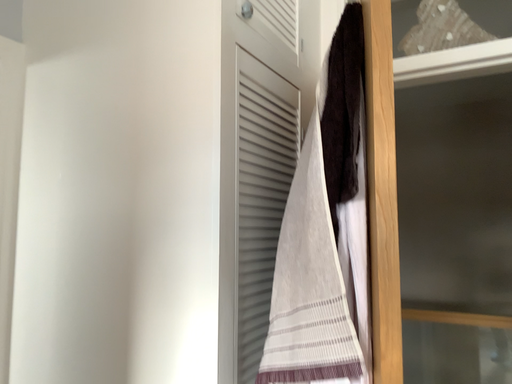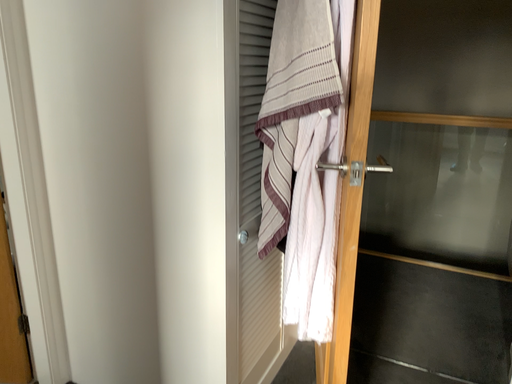
Question: Which way did the camera rotate in the video?

Choices:
 (A) rotated downward
 (B) rotated upward

Answer: (A)